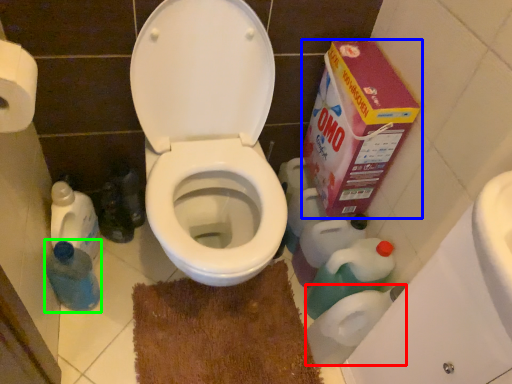
Question: Considering the real-world distances, which object is closest to toilet paper (highlighted by a red box)? cardboard box (highlighted by a blue box) or cleaning product (highlighted by a green box).

Choices:
 (A) cardboard box
 (B) cleaning product

Answer: (A)